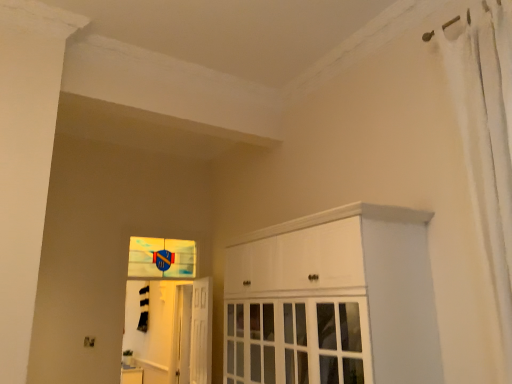
Question: In the image, is white fabric shower curtain at right on the left side or the right side of blue glass window at center?

Choices:
 (A) right
 (B) left

Answer: (A)

Question: Which is correct: white fabric shower curtain at right is inside blue glass window at center, or outside of it?

Choices:
 (A) inside
 (B) outside

Answer: (B)

Question: Which of these objects is positioned farthest from the white glossy cabinet at center?

Choices:
 (A) white glossy door at center
 (B) white fabric shower curtain at right
 (C) blue glass window at center
 (D) translucent glass screen door at lower left
 (E) metallic elevator at center

Answer: (E)

Question: Which object is positioned farthest from the blue glass window at center?

Choices:
 (A) metallic elevator at center
 (B) white glossy door at center
 (C) white fabric shower curtain at right
 (D) translucent glass screen door at lower left
 (E) white glossy cabinet at center

Answer: (C)